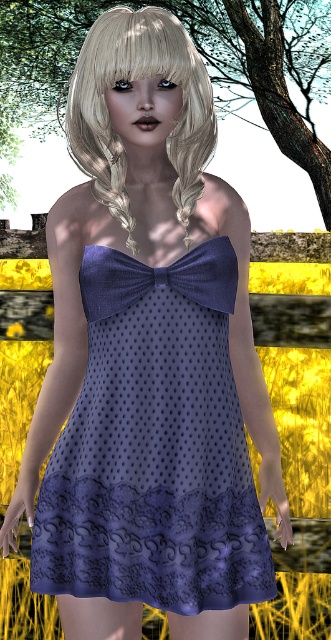
Based on the scene, which object is positioned to the left of the other? Please choose between the matte purple dress at center and the green leafy tree at upper center.

The matte purple dress at center is to the right of the green leafy tree at upper center, so the green leafy tree at upper center is positioned to the left of the matte purple dress at center.

You are a photographer adjusting the lighting for a portrait. You notice the matte purple dress at center and the blondehair at center. Which object is closer to the camera lens?

The blondehair at center is closer to the camera lens because the matte purple dress at center is positioned under it, indicating it is behind.

You are a photographer trying to capture the subject wearing the strapless dress. You notice the green leafy tree at upper center and the blondehair at center. Which object takes up more space in the photo?

The green leafy tree at upper center takes up more space in the photo because it is larger in size than the blondehair at center.